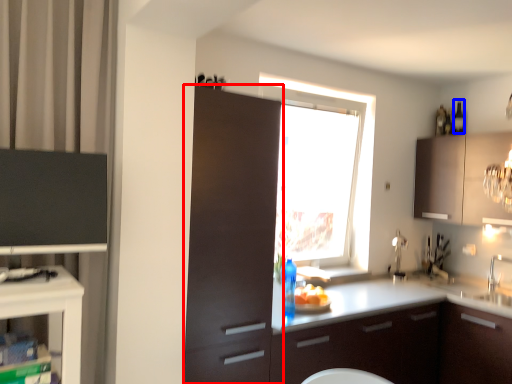
Question: Among these objects, which one is nearest to the camera, cabinetry (highlighted by a red box) or bottle (highlighted by a blue box)?

Choices:
 (A) cabinetry
 (B) bottle

Answer: (A)